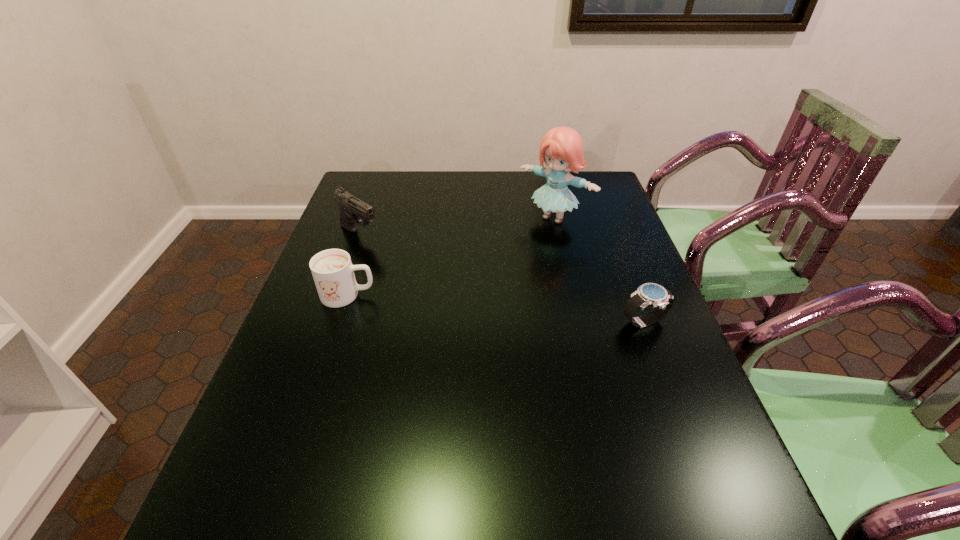
Find the location of `the third farthest object`. the third farthest object is located at coordinates (332, 270).

Where is `the nearest object`? The height and width of the screenshot is (540, 960). the nearest object is located at coordinates (653, 295).

Where is `doll`? Image resolution: width=960 pixels, height=540 pixels. doll is located at coordinates (561, 148).

I want to click on the third shortest object, so pyautogui.click(x=353, y=211).

The image size is (960, 540). I want to click on vacant space situated on the side with the handle of the third farthest object, so click(402, 295).

The image size is (960, 540). Find the location of `vacant region located on the back of the nearest object`. vacant region located on the back of the nearest object is located at coordinates (634, 294).

You are a GUI agent. You are given a task and a screenshot of the screen. Output one action in this format:
    pyautogui.click(x=<x>, y=<y>)
    Task: Click on the free region located 0.360m on the front-facing side of the tallest object
    The height and width of the screenshot is (540, 960).
    Given the screenshot: What is the action you would take?
    pyautogui.click(x=470, y=295)

The height and width of the screenshot is (540, 960). I want to click on blank space located on the front-facing side of the tallest object, so click(x=497, y=268).

Find the location of a particular element. vacant space located on the front-facing side of the tallest object is located at coordinates (466, 299).

Locate an element on the screen. This screenshot has height=540, width=960. vacant region located 0.050m at the barrel of the third shortest object is located at coordinates (384, 251).